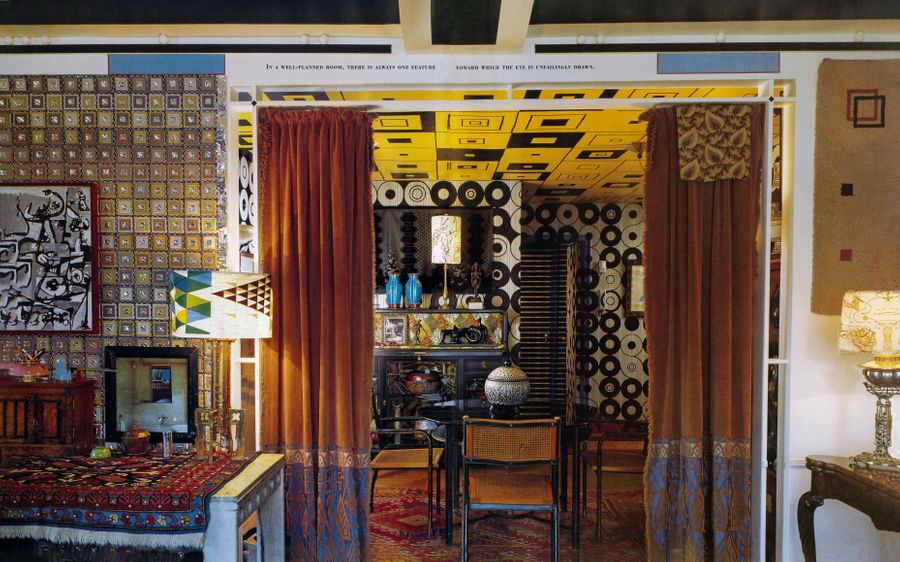
I want to click on yellow and black ceiling, so point(515,158), point(600,155), point(412,135), point(245,132).